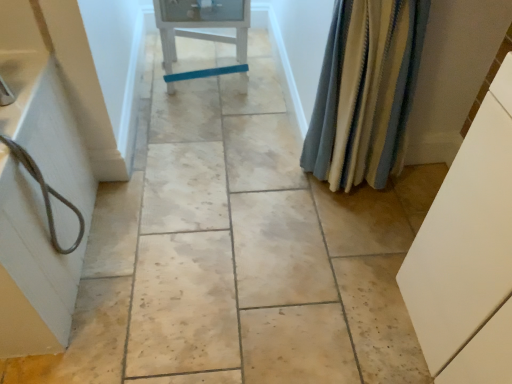
At what (x,y) coordinates should I click in order to perform the action: click on vacant space positioned to the left of white matte cabinet at right. Please return your answer as a coordinate pair (x, y). The height and width of the screenshot is (384, 512). Looking at the image, I should click on (340, 320).